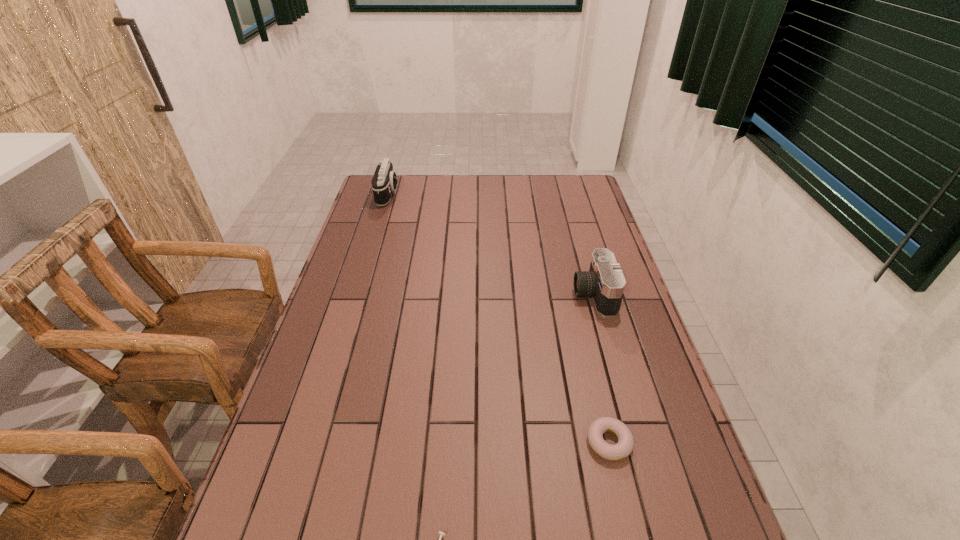
Image resolution: width=960 pixels, height=540 pixels. I want to click on free space that is in between the nearer camera and the left camera, so click(x=491, y=244).

Find the location of `free space between the farther camera and the doughnut`. free space between the farther camera and the doughnut is located at coordinates (498, 319).

I want to click on free point between the leftmost object and the doughnut, so click(498, 319).

Locate which object ranks third in proximity to the second farthest object. Please provide its 2D coordinates. Your answer should be formatted as a tuple, i.e. [(x, y)], where the tuple contains the x and y coordinates of a point satisfying the conditions above.

[(384, 182)]

At what (x,y) coordinates should I click in order to perform the action: click on the second closest object to the left camera. Please return your answer as a coordinate pair (x, y). Image resolution: width=960 pixels, height=540 pixels. Looking at the image, I should click on (625, 445).

Identify the location of vacant space that satisfies the following two spatial constraints: 1. on the front lens of the left camera; 2. on the right side of the third farthest object. (313, 442).

What are the coordinates of `vacant area that satisfies the following two spatial constraints: 1. on the front lens of the leftmost object; 2. on the back side of the second nearest object` in the screenshot? It's located at (313, 442).

This screenshot has height=540, width=960. Identify the location of vacant space that satisfies the following two spatial constraints: 1. on the front lens of the farthest object; 2. on the right side of the third farthest object. (313, 442).

The image size is (960, 540). What are the coordinates of `vacant point that satisfies the following two spatial constraints: 1. on the front lens of the left camera; 2. on the back side of the second shortest object` in the screenshot? It's located at (313, 442).

Find the location of a particular element. vacant space that satisfies the following two spatial constraints: 1. on the front lens of the farther camera; 2. on the back side of the second shortest object is located at coordinates (313, 442).